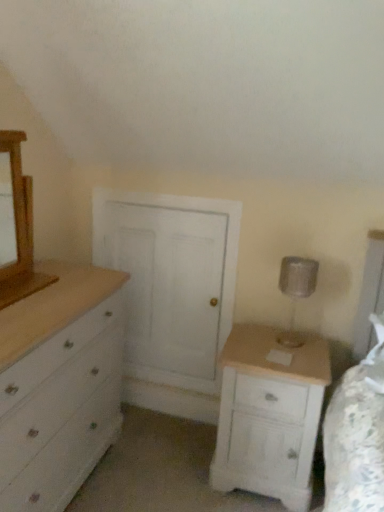
What do you see at coordinates (296, 291) in the screenshot? This screenshot has height=512, width=384. I see `silver metallic table lamp at right` at bounding box center [296, 291].

Locate an element on the screen. Image resolution: width=384 pixels, height=512 pixels. silver metallic table lamp at right is located at coordinates (296, 291).

Measure the distance between wooden medicine cabinet at left and camera.

The depth of wooden medicine cabinet at left is 5.04 feet.

In order to click on white wood nightstand at lower right in this screenshot , I will do coord(269,415).

This screenshot has width=384, height=512. Find the location of `white painted wood chest of drawers at left`. white painted wood chest of drawers at left is located at coordinates (59, 385).

Is white wood nightstand at lower right wider or thinner than wooden medicine cabinet at left?

Considering their sizes, white wood nightstand at lower right looks broader than wooden medicine cabinet at left.

Is white wood nightstand at lower right smaller than wooden medicine cabinet at left?

Actually, white wood nightstand at lower right might be larger than wooden medicine cabinet at left.

Considering the positions of points (280, 382) and (15, 221), is point (280, 382) closer to camera compared to point (15, 221)?

No, (280, 382) is further to viewer.

In the scene shown: Considering the relative sizes of white wood nightstand at lower right and wooden medicine cabinet at left in the image provided, is white wood nightstand at lower right taller than wooden medicine cabinet at left?

Indeed, white wood nightstand at lower right has a greater height compared to wooden medicine cabinet at left.

Considering the relative sizes of wooden medicine cabinet at left and white wood nightstand at lower right in the image provided, is wooden medicine cabinet at left wider than white wood nightstand at lower right?

Incorrect, the width of wooden medicine cabinet at left does not surpass that of white wood nightstand at lower right.

Who is bigger, wooden medicine cabinet at left or white wood nightstand at lower right?

white wood nightstand at lower right is bigger.

Which of these two, silver metallic table lamp at right or wooden medicine cabinet at left, stands shorter?

With less height is silver metallic table lamp at right.

Considering the positions of objects silver metallic table lamp at right and wooden medicine cabinet at left in the image provided, who is behind, silver metallic table lamp at right or wooden medicine cabinet at left?

silver metallic table lamp at right is further away from the camera.

Are silver metallic table lamp at right and wooden medicine cabinet at left far apart?

Yes, silver metallic table lamp at right is far from wooden medicine cabinet at left.

Is point (306, 293) positioned behind point (13, 302)?

Yes, it is.

In the image, there is a wooden medicine cabinet at left. In order to click on the chest of drawers below it (from a real-world perspective) in this screenshot , I will do `click(59, 385)`.

Does point (31, 447) appear closer or farther from the camera than point (26, 285)?

Point (31, 447) is positioned closer to the camera compared to point (26, 285).

How different are the orientations of white painted wood chest of drawers at left and wooden medicine cabinet at left in degrees?

The facing directions of white painted wood chest of drawers at left and wooden medicine cabinet at left are 0.659 degrees apart.

From the image's perspective, which one is positioned lower, white painted wood chest of drawers at left or wooden medicine cabinet at left?

white painted wood chest of drawers at left, from the image's perspective.

Is wooden medicine cabinet at left not inside white painted wood chest of drawers at left?

That's correct, wooden medicine cabinet at left is outside of white painted wood chest of drawers at left.

Measure the distance between wooden medicine cabinet at left and white painted wood chest of drawers at left.

They are 40.09 centimeters apart.

Which object is more forward, wooden medicine cabinet at left or white painted wood chest of drawers at left?

white painted wood chest of drawers at left is in front.

From a real-world perspective, who is located higher, wooden medicine cabinet at left or white painted wood chest of drawers at left?

wooden medicine cabinet at left is physically above.

From a real-world perspective, is white wood nightstand at lower right below silver metallic table lamp at right?

Correct, in the physical world, white wood nightstand at lower right is lower than silver metallic table lamp at right.

Considering the relative sizes of white wood nightstand at lower right and silver metallic table lamp at right in the image provided, is white wood nightstand at lower right thinner than silver metallic table lamp at right?

In fact, white wood nightstand at lower right might be wider than silver metallic table lamp at right.

Is white wood nightstand at lower right turned away from silver metallic table lamp at right?

white wood nightstand at lower right does not have its back to silver metallic table lamp at right.

Is white wood nightstand at lower right bigger than silver metallic table lamp at right?

Yes.

From a real-world perspective, which is physically below, white painted wood chest of drawers at left or silver metallic table lamp at right?

In real-world perspective, white painted wood chest of drawers at left is lower.

Which of these two, white painted wood chest of drawers at left or silver metallic table lamp at right, is smaller?

Smaller between the two is silver metallic table lamp at right.

From the image's perspective, between white painted wood chest of drawers at left and silver metallic table lamp at right, which one is located above?

silver metallic table lamp at right appears higher in the image.

Is white painted wood chest of drawers at left taller or shorter than silver metallic table lamp at right?

Considering their sizes, white painted wood chest of drawers at left has more height than silver metallic table lamp at right.

Identify the location of medicine cabinet in front of the white wood nightstand at lower right. The width and height of the screenshot is (384, 512). (16, 225).

Locate an element on the screen. nightstand below the wooden medicine cabinet at left (from the image's perspective) is located at coordinates (269, 415).

Looking at the image, which one is located further to silver metallic table lamp at right, wooden medicine cabinet at left or white wood nightstand at lower right?

Based on the image, wooden medicine cabinet at left appears to be further to silver metallic table lamp at right.

Which object lies further to the anchor point white painted wood chest of drawers at left, white wood nightstand at lower right or wooden medicine cabinet at left?

Based on the image, white wood nightstand at lower right appears to be further to white painted wood chest of drawers at left.

Estimate the real-world distances between objects in this image. Which object is closer to wooden medicine cabinet at left, silver metallic table lamp at right or white wood nightstand at lower right?

Among the two, white wood nightstand at lower right is located nearer to wooden medicine cabinet at left.

Looking at the image, which one is located further to white wood nightstand at lower right, white painted wood chest of drawers at left or wooden medicine cabinet at left?

Based on the image, wooden medicine cabinet at left appears to be further to white wood nightstand at lower right.

Considering their positions, is wooden medicine cabinet at left positioned closer to white wood nightstand at lower right than white painted wood chest of drawers at left?

The object closer to white wood nightstand at lower right is white painted wood chest of drawers at left.

Looking at the image, which one is located closer to white painted wood chest of drawers at left, wooden medicine cabinet at left or silver metallic table lamp at right?

wooden medicine cabinet at left is positioned closer to the anchor white painted wood chest of drawers at left.

Looking at this image, considering their positions, is white painted wood chest of drawers at left positioned closer to silver metallic table lamp at right than wooden medicine cabinet at left?

white painted wood chest of drawers at left.

Estimate the real-world distances between objects in this image. Which object is closer to white painted wood chest of drawers at left, white wood nightstand at lower right or silver metallic table lamp at right?

white wood nightstand at lower right is positioned closer to the anchor white painted wood chest of drawers at left.

The width and height of the screenshot is (384, 512). I want to click on nightstand between white painted wood chest of drawers at left and silver metallic table lamp at right, so click(269, 415).

Identify the location of chest of drawers between wooden medicine cabinet at left and white wood nightstand at lower right. The height and width of the screenshot is (512, 384). (59, 385).

Locate an element on the screen. The image size is (384, 512). chest of drawers between wooden medicine cabinet at left and silver metallic table lamp at right is located at coordinates (59, 385).

What are the coordinates of `nightstand located between wooden medicine cabinet at left and silver metallic table lamp at right in the left-right direction` in the screenshot? It's located at (269, 415).